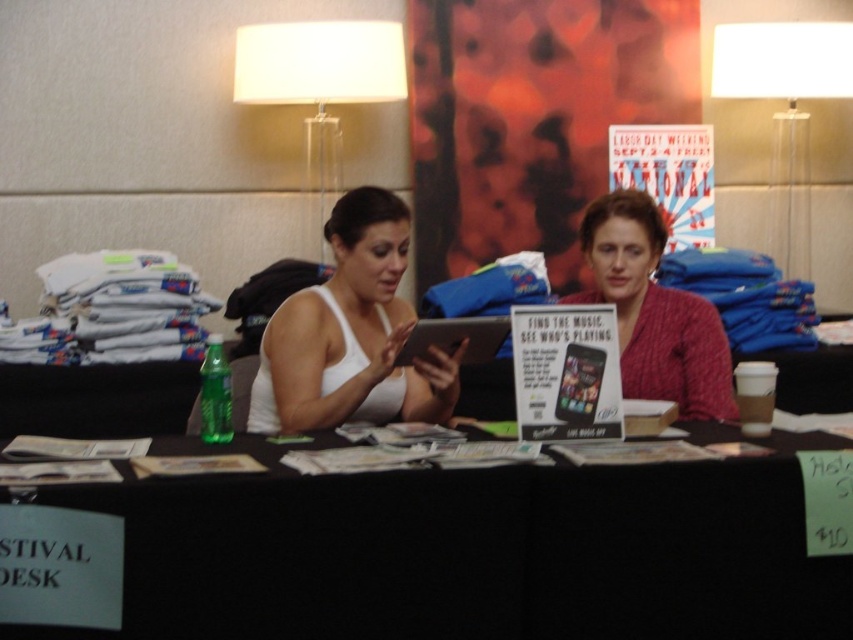
Question: Which point appears farthest from the camera in this image?

Choices:
 (A) (741, 61)
 (B) (398, 413)
 (C) (590, 388)
 (D) (15, 621)

Answer: (A)

Question: Does white matte tank top at center appear under knitted red sweater at center?

Choices:
 (A) yes
 (B) no

Answer: (A)

Question: Considering the relative positions of white matte tank top at center and matte black tablet at center in the image provided, where is white matte tank top at center located with respect to matte black tablet at center?

Choices:
 (A) left
 (B) right

Answer: (A)

Question: Which point appears closest to the camera in this image?

Choices:
 (A) (115, 486)
 (B) (756, 29)

Answer: (A)

Question: Is matte black tablet at center above black glossy tablet at center?

Choices:
 (A) yes
 (B) no

Answer: (A)

Question: Which of the following is the closest to the observer?

Choices:
 (A) matte black tablet at center
 (B) white fabric lampshade at upper center
 (C) black fabric table at center
 (D) white matte tank top at center

Answer: (C)